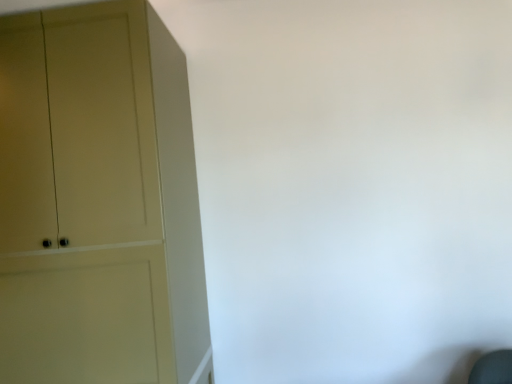
Question: Should I look upward or downward to see matte beige cupboard at left?

Choices:
 (A) down
 (B) up

Answer: (A)